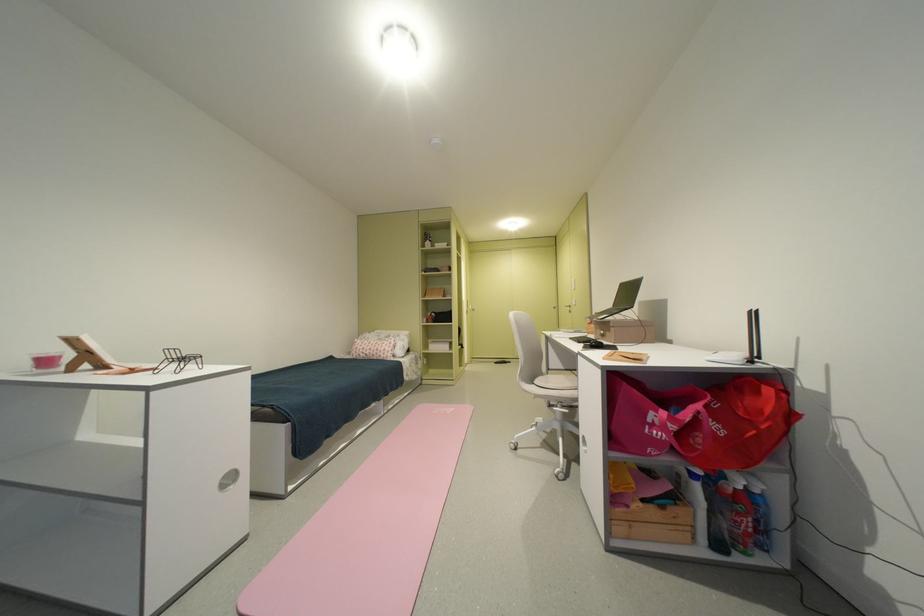
This screenshot has height=616, width=924. Identify the location of red tote bag. (739, 424).